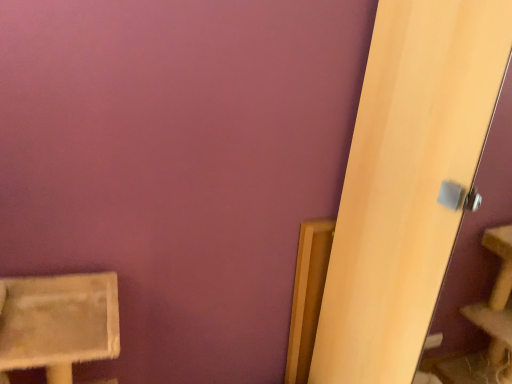
Question: Looking at their shapes, would you say beige textured cat tree at lower left is wider or thinner than light wood screen door at right?

Choices:
 (A) wide
 (B) thin

Answer: (B)

Question: Is point (13, 307) closer or farther from the camera than point (461, 193)?

Choices:
 (A) farther
 (B) closer

Answer: (A)

Question: From a real-world perspective, is beige textured cat tree at lower left physically located above or below light wood screen door at right?

Choices:
 (A) above
 (B) below

Answer: (B)

Question: Is point pos(359,248) positioned closer to the camera than point pos(25,354)?

Choices:
 (A) closer
 (B) farther

Answer: (B)

Question: From the image's perspective, is light wood screen door at right located above or below beige textured cat tree at lower left?

Choices:
 (A) below
 (B) above

Answer: (B)

Question: Looking at the image, does light wood screen door at right seem bigger or smaller compared to beige textured cat tree at lower left?

Choices:
 (A) big
 (B) small

Answer: (A)

Question: In the image, is light wood screen door at right positioned in front of or behind beige textured cat tree at lower left?

Choices:
 (A) behind
 (B) front

Answer: (B)